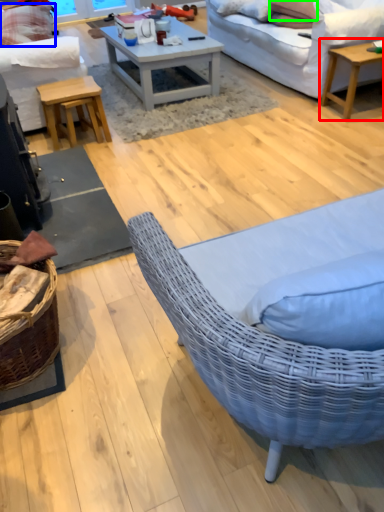
Question: Which object is positioned closest to coffee table (highlighted by a red box)? Select from pillow (highlighted by a blue box) and pillow (highlighted by a green box).

Choices:
 (A) pillow
 (B) pillow

Answer: (B)